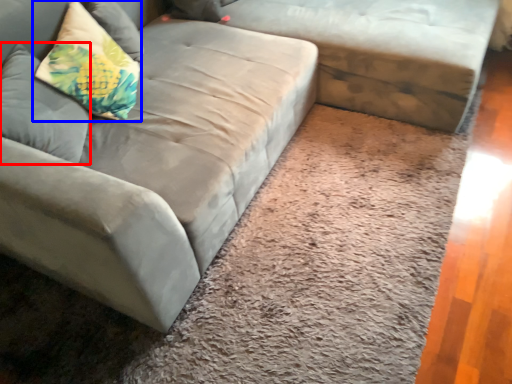
Question: Which of the following is the closest to the observer, pillow (highlighted by a red box) or pillow (highlighted by a blue box)?

Choices:
 (A) pillow
 (B) pillow

Answer: (A)